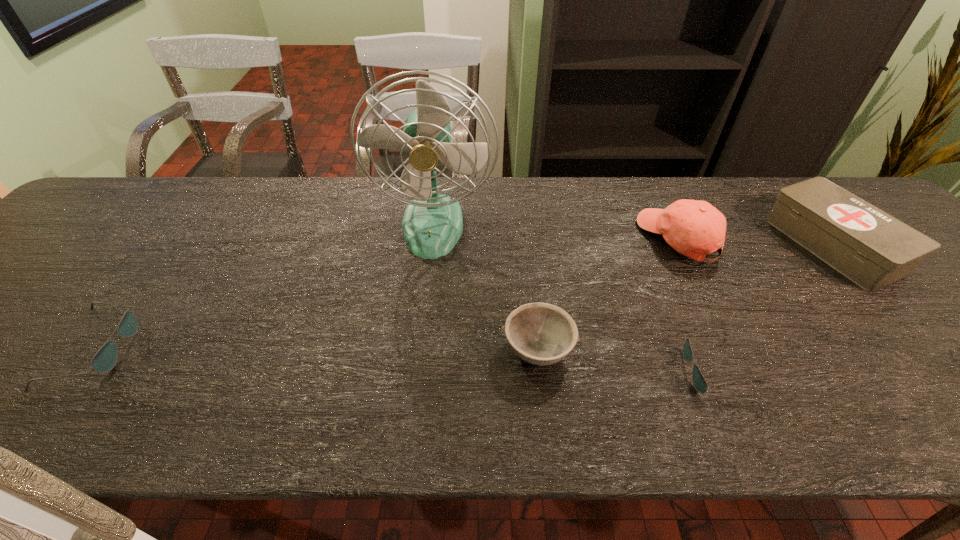
Image resolution: width=960 pixels, height=540 pixels. I want to click on vacant space in between the third shortest object and the fan, so click(486, 287).

Where is `free spot between the right sunglasses and the fifth tallest object`? free spot between the right sunglasses and the fifth tallest object is located at coordinates (405, 361).

Find the location of a particular element. vacant area that lies between the second tallest object and the second shortest object is located at coordinates (388, 294).

Image resolution: width=960 pixels, height=540 pixels. What are the coordinates of `vacant area that lies between the taller sunglasses and the fan` in the screenshot? It's located at [265, 287].

Select which object is the fifth closest to the rightmost object. Please provide its 2D coordinates. Your answer should be formatted as a tuple, i.e. [(x, y)], where the tuple contains the x and y coordinates of a point satisfying the conditions above.

[(105, 359)]

Point out which object is positioned as the nearest to the fourth tallest object. Please provide its 2D coordinates. Your answer should be formatted as a tuple, i.e. [(x, y)], where the tuple contains the x and y coordinates of a point satisfying the conditions above.

[(432, 224)]

Where is `vacant space that satisfies the following two spatial constraints: 1. in front of the fan, directing airflow; 2. on the lenses of the taller sunglasses`? This screenshot has height=540, width=960. vacant space that satisfies the following two spatial constraints: 1. in front of the fan, directing airflow; 2. on the lenses of the taller sunglasses is located at coordinates (420, 349).

Where is `free space in the image that satisfies the following two spatial constraints: 1. in front of the tallest object, directing airflow; 2. on the left side of the third tallest object`? The height and width of the screenshot is (540, 960). free space in the image that satisfies the following two spatial constraints: 1. in front of the tallest object, directing airflow; 2. on the left side of the third tallest object is located at coordinates (431, 245).

This screenshot has width=960, height=540. I want to click on free point that satisfies the following two spatial constraints: 1. on the lenses of the taller sunglasses; 2. on the back side of the fourth tallest object, so click(95, 350).